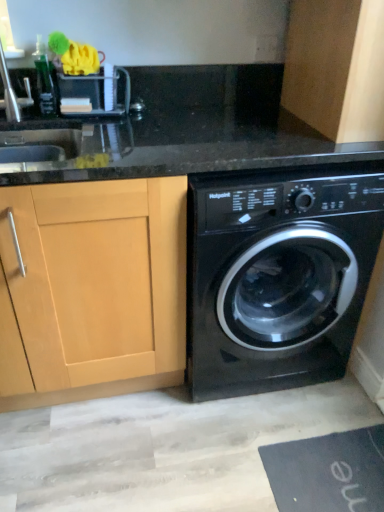
Locate an element on the screen. The height and width of the screenshot is (512, 384). vacant area on top of black rubber bath mat at lower right (from a real-world perspective) is located at coordinates (339, 465).